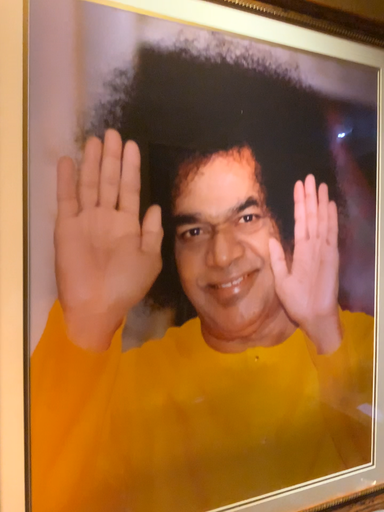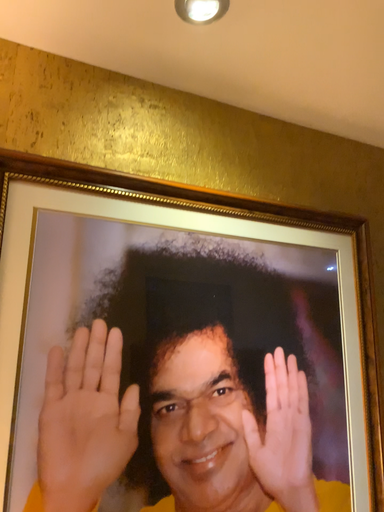
Question: How did the camera likely rotate when shooting the video?

Choices:
 (A) rotated downward
 (B) rotated upward

Answer: (B)